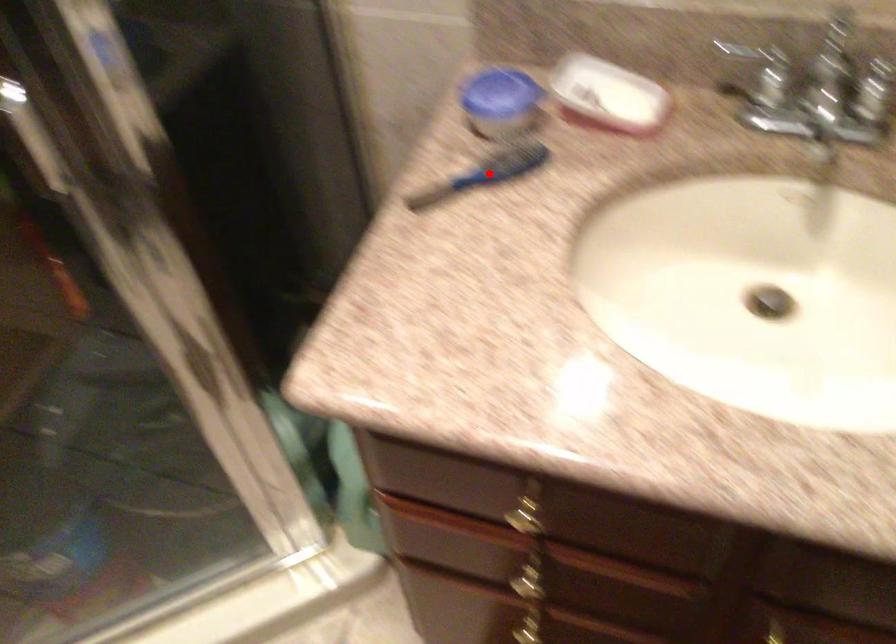
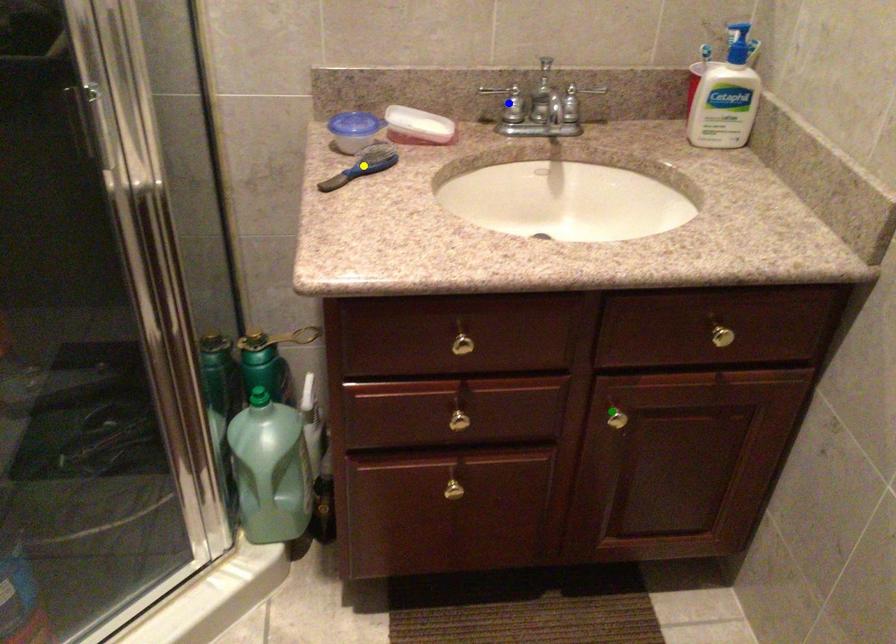
Question: I am providing you with two images of the same scene from different viewpoints. A red point is marked on the first image. You are given multiple points on the second image. Which point in image 2 is actually the same real-world point as the red point in image 1?

Choices:
 (A) yellow point
 (B) blue point
 (C) green point

Answer: (A)